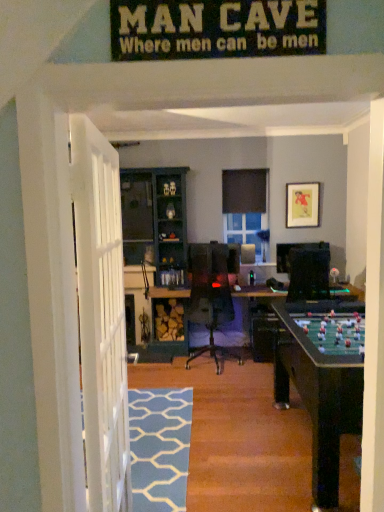
Where is `free point to the right of blue textured rug at lower center`? free point to the right of blue textured rug at lower center is located at coordinates (243, 438).